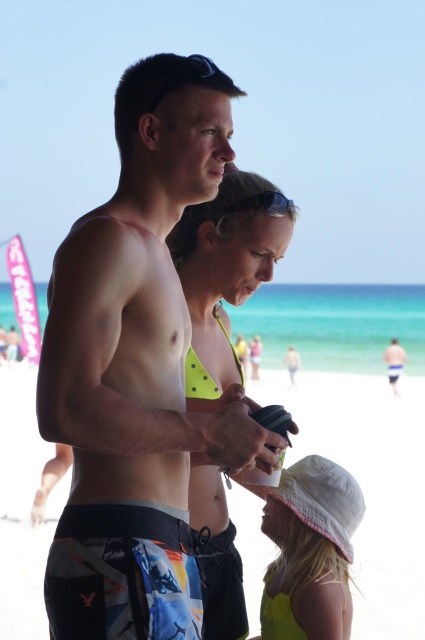
You are a photographer trying to capture a photo of both the multicolored board shorts at center and the white cotton hat at lower right in the same frame. Your camera has a maximum focus range of 1.6 meters. Can you fit both objects in the frame without moving closer or farther away?

The multicolored board shorts at center and white cotton hat at lower right are 1.55 meters apart from each other, so yes, the camera can capture both objects in the same frame since the distance between them is within the 1.6 meters focus range.

You are a photographer trying to capture a photo of the beach scene. You want to ensure that both the multicolored board shorts at center and the white fabric hat at lower center are clearly visible. Based on their sizes, which object should you focus on first to ensure it stands out more in the photo?

The multicolored board shorts at center has a greater height compared to the white fabric hat at lower center, so focusing on the multicolored board shorts at center first will ensure it stands out more due to its larger size.

You are a photographer trying to capture a photo of the beach scene. You have two points marked on your camera screen at coordinates point (x=187, y=307) and point (x=288, y=472). Which point is closer to you when you take the photo?

Point (x=187, y=307) is closer to the viewer than point (x=288, y=472).